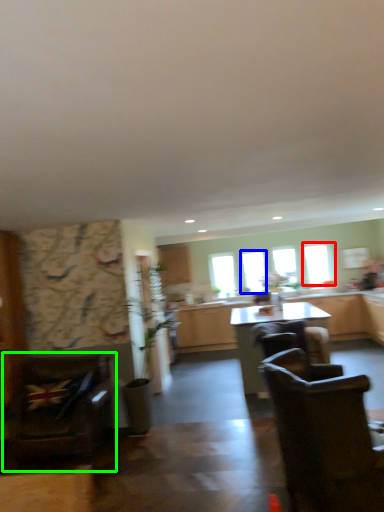
Question: Which is nearer to the window (highlighted by a red box)? window (highlighted by a blue box) or chair (highlighted by a green box).

Choices:
 (A) window
 (B) chair

Answer: (A)